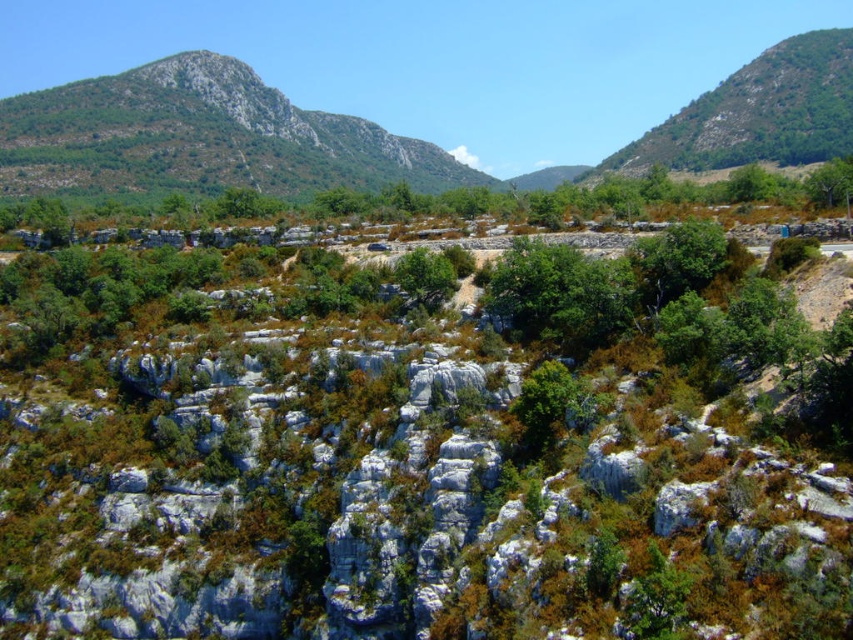
Question: Estimate the real-world distances between objects in this image. Which object is closer to the green leafy hillside at upper right?

Choices:
 (A) green leafy tree at center
 (B) rugged stone mountain at upper left

Answer: (B)

Question: Can you confirm if green leafy hillside at upper right is wider than green leafy tree at center?

Choices:
 (A) no
 (B) yes

Answer: (B)

Question: Is green leafy hillside at upper right above green leafy tree at center?

Choices:
 (A) yes
 (B) no

Answer: (A)

Question: Which is nearer to the green leafy hillside at upper right?

Choices:
 (A) green leafy tree at center
 (B) rugged stone mountain at upper left

Answer: (B)

Question: Is rugged stone mountain at upper left positioned at the back of green leafy tree at center?

Choices:
 (A) no
 (B) yes

Answer: (B)

Question: Which object is farther from the camera taking this photo?

Choices:
 (A) rugged stone mountain at upper left
 (B) green leafy hillside at upper right
 (C) green leafy tree at center

Answer: (B)